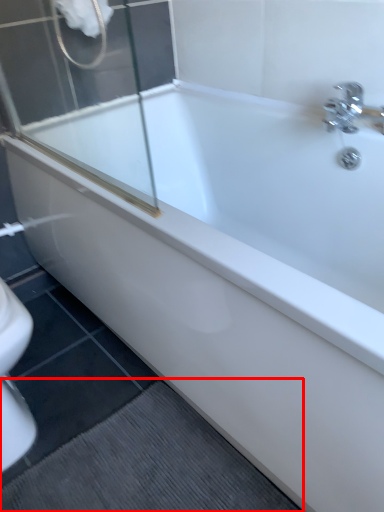
Question: From the image, what is the correct spatial relationship of bath mat (annotated by the red box) in relation to shower?

Choices:
 (A) left
 (B) right

Answer: (B)